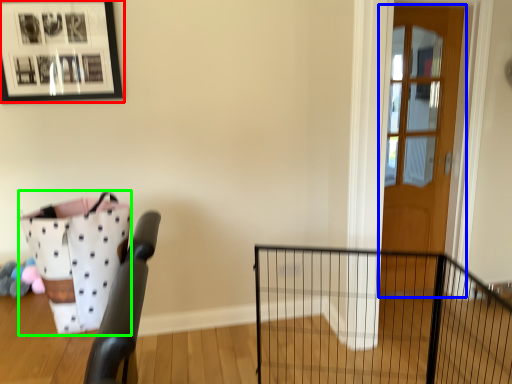
Question: Estimate the real-world distances between objects in this image. Which object is farther from picture frame (highlighted by a red box), door (highlighted by a blue box) or basket (highlighted by a green box)?

Choices:
 (A) door
 (B) basket

Answer: (A)